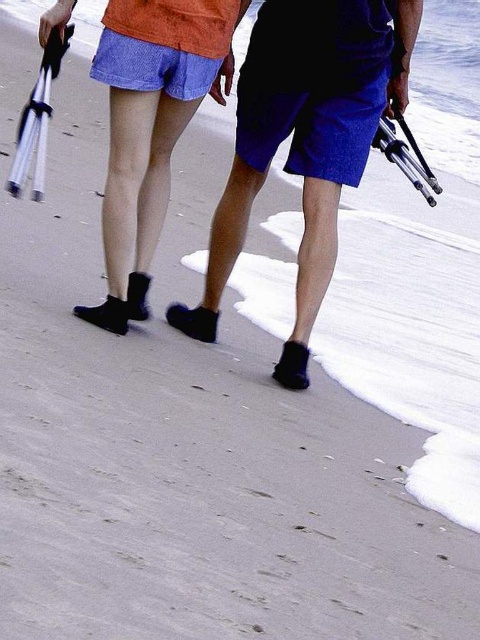
Question: Does black rubber sandals at center appear on the left side of white matte umbrella at left?

Choices:
 (A) yes
 (B) no

Answer: (B)

Question: Which point is closer to the camera?

Choices:
 (A) matte black flippers at upper left
 (B) white matte umbrella at left

Answer: (A)

Question: Is black rubber sandals at center thinner than matte black socks at center?

Choices:
 (A) no
 (B) yes

Answer: (A)

Question: Does matte black socks at center appear over white matte umbrella at left?

Choices:
 (A) yes
 (B) no

Answer: (B)

Question: Which object is positioned farthest from the matte black socks at center?

Choices:
 (A) black rubber sandals at center
 (B) matte black flippers at upper left

Answer: (B)

Question: Which point is closer to the camera taking this photo?

Choices:
 (A) (26, 166)
 (B) (255, 115)
 (C) (68, 17)

Answer: (C)